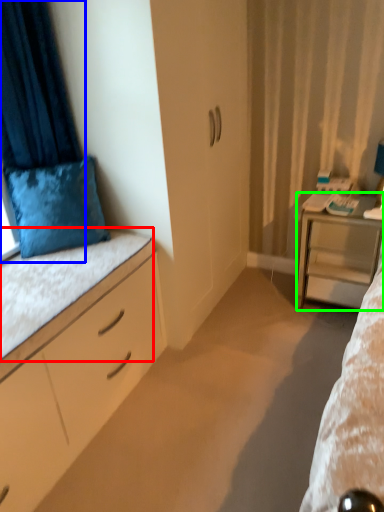
Question: Which object is positioned closest to ledge (highlighted by a red box)? Select from curtain (highlighted by a blue box) and desk (highlighted by a green box).

Choices:
 (A) curtain
 (B) desk

Answer: (A)